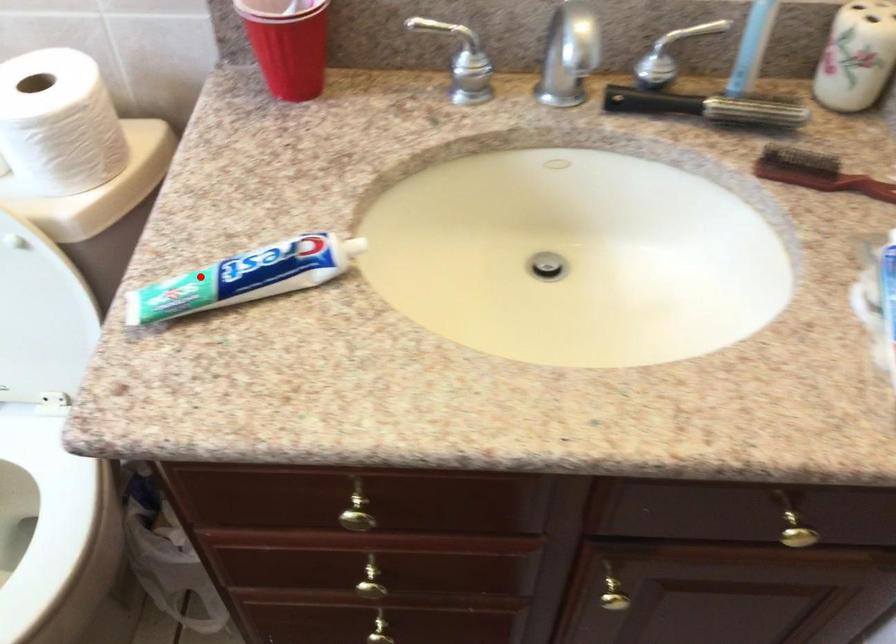
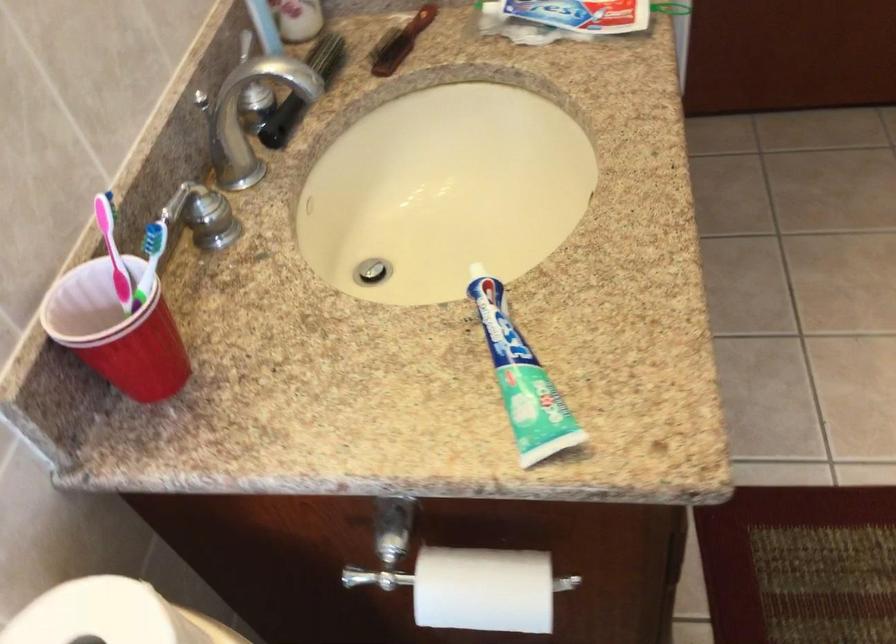
In the second image, find the point that corresponds to the highlighted location in the first image.

(521, 379)